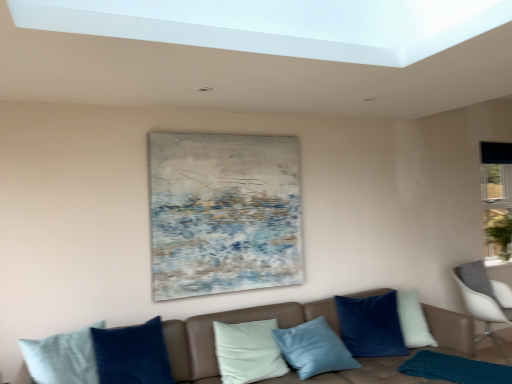
Question: From a real-world perspective, is teal knitted mat at lower right located beneath textured canvas painting at upper center?

Choices:
 (A) yes
 (B) no

Answer: (A)

Question: From a real-world perspective, is teal knitted mat at lower right over textured canvas painting at upper center?

Choices:
 (A) no
 (B) yes

Answer: (A)

Question: Is textured canvas painting at upper center completely or partially inside teal knitted mat at lower right?

Choices:
 (A) no
 (B) yes

Answer: (A)

Question: Is teal knitted mat at lower right wider than textured canvas painting at upper center?

Choices:
 (A) no
 (B) yes

Answer: (B)

Question: Can you confirm if teal knitted mat at lower right is thinner than textured canvas painting at upper center?

Choices:
 (A) yes
 (B) no

Answer: (B)

Question: Can you confirm if teal knitted mat at lower right is shorter than textured canvas painting at upper center?

Choices:
 (A) yes
 (B) no

Answer: (A)

Question: From the image's perspective, is white glossy window sill at lower right on brown leather couch at lower center?

Choices:
 (A) no
 (B) yes

Answer: (B)

Question: Is white glossy window sill at lower right facing away from brown leather couch at lower center?

Choices:
 (A) yes
 (B) no

Answer: (B)

Question: From a real-world perspective, is white glossy window sill at lower right below brown leather couch at lower center?

Choices:
 (A) yes
 (B) no

Answer: (B)

Question: Is the depth of white glossy window sill at lower right less than that of brown leather couch at lower center?

Choices:
 (A) yes
 (B) no

Answer: (B)

Question: Is the position of white glossy window sill at lower right more distant than that of brown leather couch at lower center?

Choices:
 (A) no
 (B) yes

Answer: (B)

Question: Does white glossy window sill at lower right have a larger size compared to brown leather couch at lower center?

Choices:
 (A) no
 (B) yes

Answer: (A)

Question: Is textured canvas painting at upper center further to camera compared to brown leather couch at lower center?

Choices:
 (A) yes
 (B) no

Answer: (A)